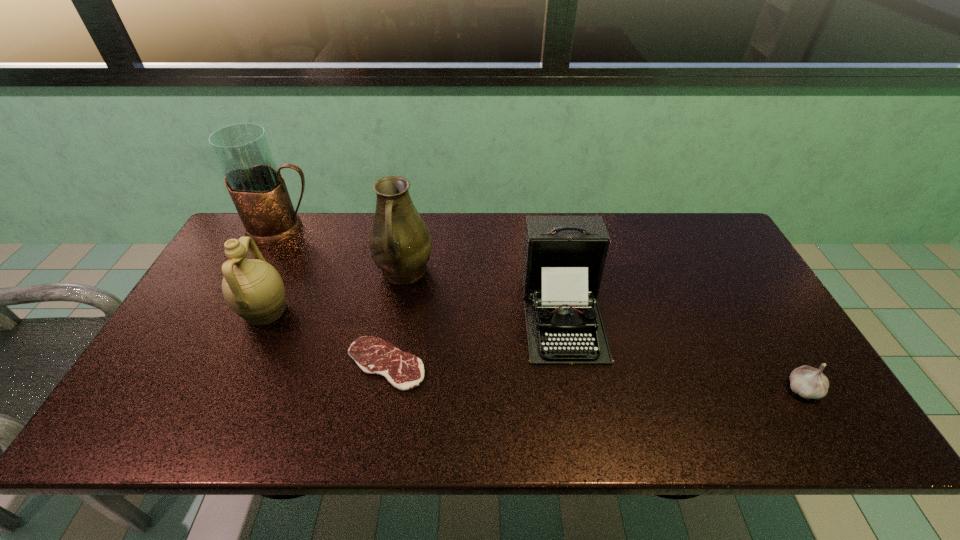
This screenshot has width=960, height=540. Find the location of `vacant space at the far right corner of the desktop`. vacant space at the far right corner of the desktop is located at coordinates (715, 225).

What are the coordinates of `free space at the near right corner of the desktop` in the screenshot? It's located at (769, 409).

Locate an element on the screen. The height and width of the screenshot is (540, 960). free spot between the typewriter and the rightmost pitcher is located at coordinates (483, 293).

You are a GUI agent. You are given a task and a screenshot of the screen. Output one action in this format:
    pyautogui.click(x=<x>, y=<y>)
    Task: Click on the vacant region between the shortest pitcher and the fifth object from left to right
    This screenshot has height=540, width=960.
    Given the screenshot: What is the action you would take?
    pyautogui.click(x=414, y=313)

Find the location of a particular element. The width and height of the screenshot is (960, 540). vacant area that lies between the shortest pitcher and the steak is located at coordinates (325, 338).

Locate an element on the screen. This screenshot has height=540, width=960. vacant space in between the rightmost pitcher and the shortest pitcher is located at coordinates (335, 292).

At what (x,y) coordinates should I click in order to perform the action: click on vacant space in between the farthest pitcher and the fifth shortest object. Please return your answer as a coordinate pair (x, y). The height and width of the screenshot is (540, 960). Looking at the image, I should click on (344, 251).

Locate an element on the screen. free area in between the second tallest pitcher and the shortest object is located at coordinates click(x=395, y=318).

This screenshot has width=960, height=540. In order to click on object that is the second nearest to the shortest pitcher in this screenshot , I will do `click(257, 188)`.

Select which object is the fifth closest to the farthest object. Please provide its 2D coordinates. Your answer should be formatted as a tuple, i.e. [(x, y)], where the tuple contains the x and y coordinates of a point satisfying the conditions above.

[(808, 382)]